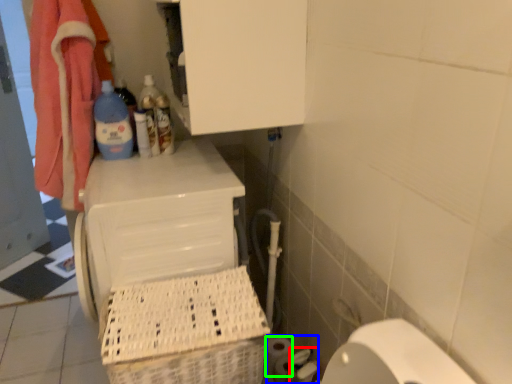
Question: Estimate the real-world distances between objects in this image. Which object is farther from toilet paper (highlighted by a red box), toilet paper (highlighted by a blue box) or toilet paper (highlighted by a green box)?

Choices:
 (A) toilet paper
 (B) toilet paper

Answer: (B)